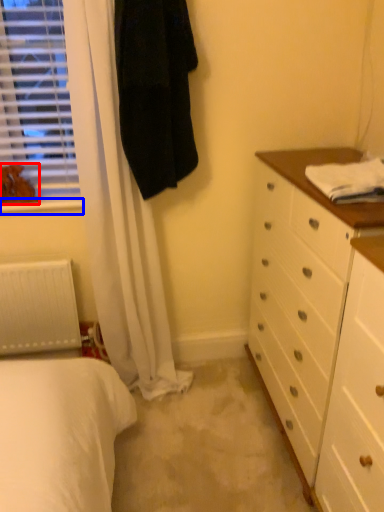
Question: Among these objects, which one is nearest to the camera, animal (highlighted by a red box) or window sill (highlighted by a blue box)?

Choices:
 (A) animal
 (B) window sill

Answer: (A)